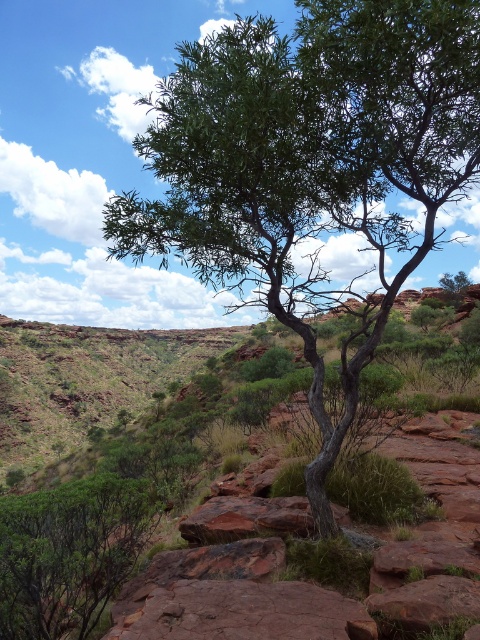
Question: Is green leafy tree at center thinner than reddish-brown rock at center?

Choices:
 (A) no
 (B) yes

Answer: (A)

Question: Can you confirm if green leafy tree at center is wider than reddish-brown rock at center?

Choices:
 (A) yes
 (B) no

Answer: (A)

Question: Among these points, which one is farthest from the camera?

Choices:
 (A) (177, 589)
 (B) (128, 528)

Answer: (B)

Question: Among these objects, which one is nearest to the camera?

Choices:
 (A) reddish-brown rock at center
 (B) green leafy tree at center
 (C) green leafy bush at lower left

Answer: (A)

Question: Which object is the closest to the green leafy bush at lower left?

Choices:
 (A) green leafy tree at center
 (B) reddish-brown rock at center

Answer: (B)

Question: Is green leafy tree at center positioned in front of green leafy bush at lower left?

Choices:
 (A) no
 (B) yes

Answer: (B)